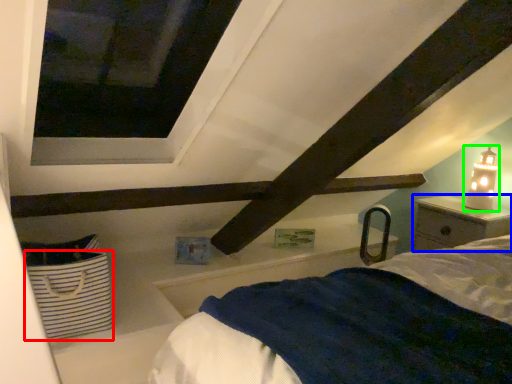
Question: Considering the real-world distances, which object is farthest from basket (highlighted by a red box)? nightstand (highlighted by a blue box) or table lamp (highlighted by a green box)?

Choices:
 (A) nightstand
 (B) table lamp

Answer: (B)